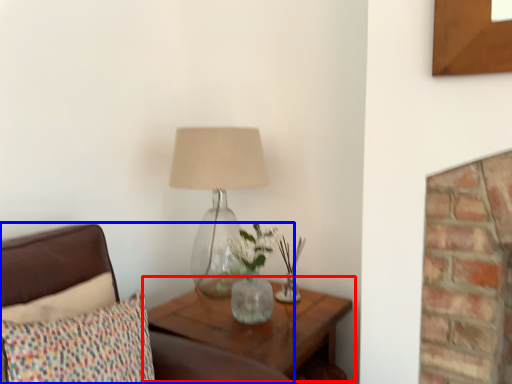
Question: Among these objects, which one is nearest to the camera, table (highlighted by a red box) or furniture (highlighted by a blue box)?

Choices:
 (A) table
 (B) furniture

Answer: (B)